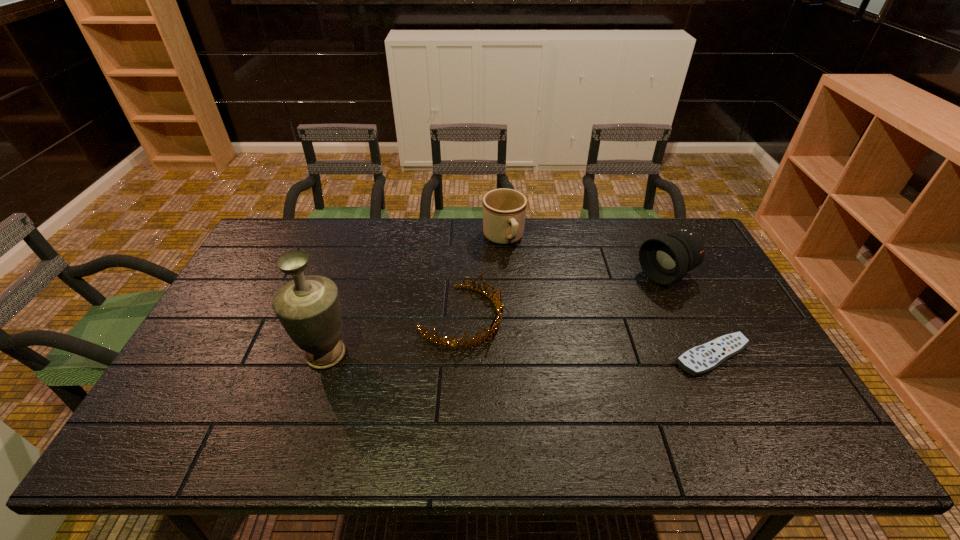
Locate an element on the screen. The width and height of the screenshot is (960, 540). telephoto lens that is at the right edge is located at coordinates (665, 258).

Locate an element on the screen. object located at the far right corner is located at coordinates (665, 258).

In order to click on vacant space at the far edge of the desktop in this screenshot , I will do (x=330, y=242).

What are the coordinates of `vacant area at the near edge of the desktop` in the screenshot? It's located at (291, 407).

Find the location of a particular element. The image size is (960, 540). vacant region at the right edge of the desktop is located at coordinates (711, 313).

Locate an element on the screen. This screenshot has height=540, width=960. free space at the far left corner is located at coordinates [259, 244].

In the image, there is a desktop. Identify the location of vacant area at the near left corner. (159, 413).

The height and width of the screenshot is (540, 960). Find the location of `vacant space that's between the mug and the shortest object`. vacant space that's between the mug and the shortest object is located at coordinates (608, 297).

Find the location of `blank region between the shortest object and the telephoto lens`. blank region between the shortest object and the telephoto lens is located at coordinates (688, 315).

This screenshot has width=960, height=540. In order to click on vacant area that lies between the telephoto lens and the mug in this screenshot , I will do `click(585, 257)`.